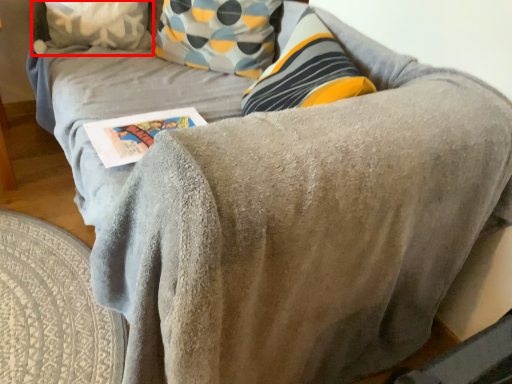
Question: From the image, what is the correct spatial relationship of pillow (annotated by the red box) in relation to paperback book?

Choices:
 (A) right
 (B) left

Answer: (B)